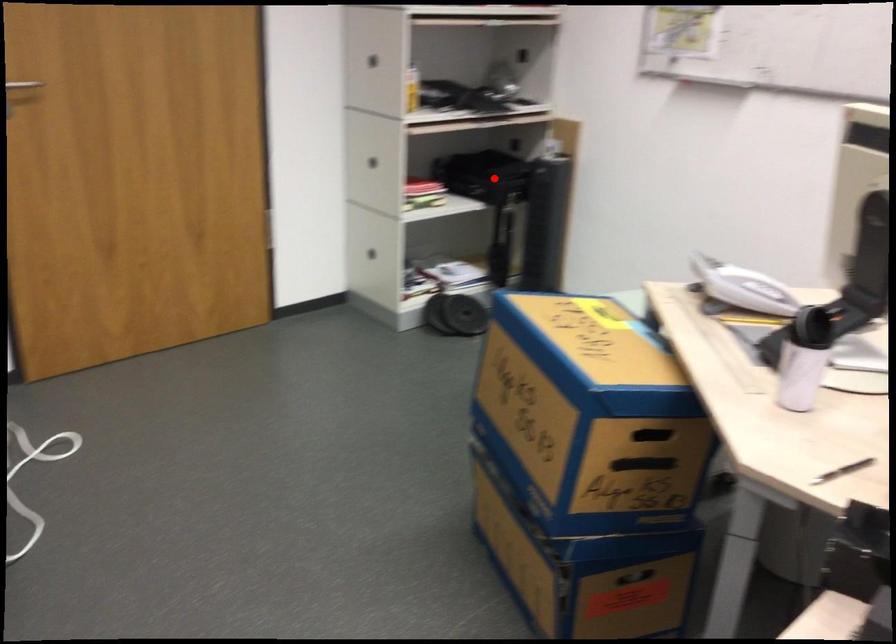
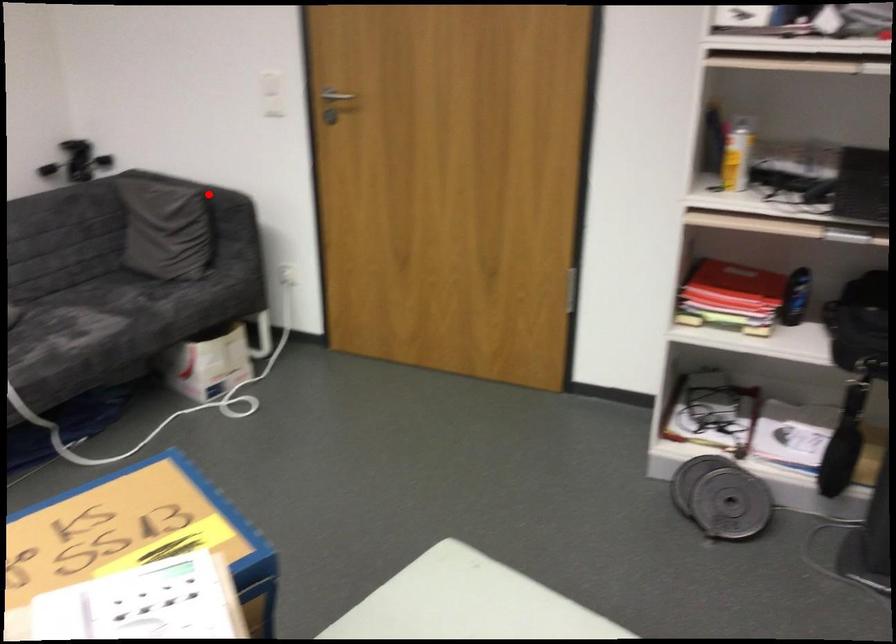
I am providing you with two images of the same scene from different viewpoints. A red point is marked on the first image and another point is marked on the second image. Does the point marked in image1 correspond to the same location as the one in image2?

No